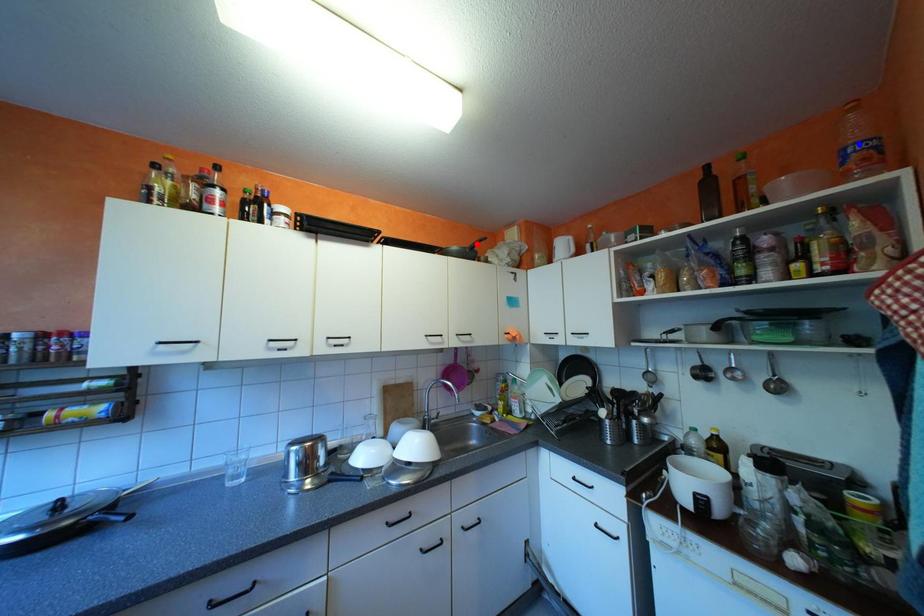
Question: In the image, two points are highlighted. Which point is nearer to the camera? Reply with the corresponding letter.

Choices:
 (A) blue point
 (B) red point

Answer: (A)